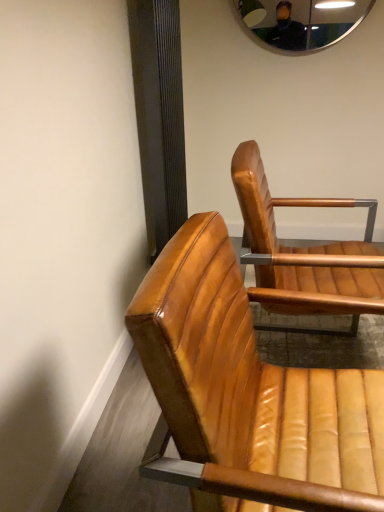
Question: Is metallic reflective mirror at upper center to the left or to the right of leather tan chair at center, the second chair viewed from the front, in the image?

Choices:
 (A) left
 (B) right

Answer: (B)

Question: Considering the positions of metallic reflective mirror at upper center and leather tan chair at center, the second chair viewed from the front, in the image, is metallic reflective mirror at upper center taller or shorter than leather tan chair at center, the second chair viewed from the front,?

Choices:
 (A) tall
 (B) short

Answer: (B)

Question: Estimate the real-world distances between objects in this image. Which object is farther from the leather chair at lower right, which is the 1th chair in front-to-back order?

Choices:
 (A) leather tan chair at center, positioned as the 1th chair in back-to-front order
 (B) metallic reflective mirror at upper center

Answer: (B)

Question: Estimate the real-world distances between objects in this image. Which object is closer to the leather tan chair at center, the second chair viewed from the front?

Choices:
 (A) metallic reflective mirror at upper center
 (B) leather chair at lower right, which is the 1th chair in front-to-back order

Answer: (B)